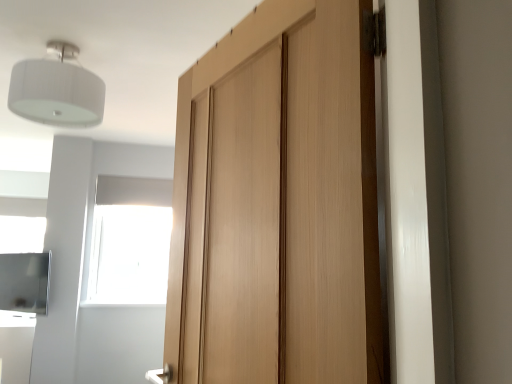
Find the location of a particular element. The height and width of the screenshot is (384, 512). white fabric lampshade at upper left is located at coordinates (57, 90).

How far apart are satin silver cabinet at lower left and transparent glass window at upper center?

satin silver cabinet at lower left and transparent glass window at upper center are 25.54 inches apart.

Is the position of satin silver cabinet at lower left more distant than that of transparent glass window at upper center?

No.

From the picture: Is satin silver cabinet at lower left at the right side of transparent glass window at upper center?

No, satin silver cabinet at lower left is not to the right of transparent glass window at upper center.

Does point (40, 296) appear closer or farther from the camera than point (117, 294)?

Point (40, 296) is positioned closer to the camera compared to point (117, 294).

The height and width of the screenshot is (384, 512). Find the location of `door that is under the white fabric lampshade at upper left (from a real-world perspective)`. door that is under the white fabric lampshade at upper left (from a real-world perspective) is located at coordinates (278, 203).

Consider the image. Is light wood door at center looking in the opposite direction of white fabric lampshade at upper left?

light wood door at center does not have its back to white fabric lampshade at upper left.

Is light wood door at center inside or outside of white fabric lampshade at upper left?

light wood door at center lies outside white fabric lampshade at upper left.

Is light wood door at center next to white fabric lampshade at upper left and touching it?

light wood door at center is not next to white fabric lampshade at upper left, and they're not touching.

Where is `cabinetry on the left of transparent glass window at upper center`? The image size is (512, 384). cabinetry on the left of transparent glass window at upper center is located at coordinates (25, 282).

From a real-world perspective, is transparent glass window at upper center located beneath satin silver cabinet at lower left?

Actually, transparent glass window at upper center is physically above satin silver cabinet at lower left in the real world.

Based on their sizes in the image, would you say transparent glass window at upper center is bigger or smaller than satin silver cabinet at lower left?

In the image, transparent glass window at upper center appears to be larger than satin silver cabinet at lower left.

From the image's perspective, who appears lower, transparent glass window at upper center or satin silver cabinet at lower left?

From the image's view, satin silver cabinet at lower left is below.

Is white fabric lampshade at upper left positioned before transparent glass window at upper center?

Yes, the depth of white fabric lampshade at upper left is less than that of transparent glass window at upper center.

Can you confirm if white fabric lampshade at upper left is bigger than transparent glass window at upper center?

No.

Between white fabric lampshade at upper left and transparent glass window at upper center, which one has smaller width?

transparent glass window at upper center.

Is white fabric lampshade at upper left located outside transparent glass window at upper center?

Absolutely, white fabric lampshade at upper left is external to transparent glass window at upper center.

Considering the relative sizes of white fabric lampshade at upper left and satin silver cabinet at lower left in the image provided, is white fabric lampshade at upper left thinner than satin silver cabinet at lower left?

Incorrect, the width of white fabric lampshade at upper left is not less than that of satin silver cabinet at lower left.

Based on the photo, which of these two, white fabric lampshade at upper left or satin silver cabinet at lower left, is smaller?

With smaller size is satin silver cabinet at lower left.

Is white fabric lampshade at upper left inside the boundaries of satin silver cabinet at lower left, or outside?

white fabric lampshade at upper left cannot be found inside satin silver cabinet at lower left.

Who is shorter, white fabric lampshade at upper left or satin silver cabinet at lower left?

Standing shorter between the two is white fabric lampshade at upper left.

Where is `light fixture located above the transparent glass window at upper center (from the image's perspective)`? This screenshot has width=512, height=384. light fixture located above the transparent glass window at upper center (from the image's perspective) is located at coordinates (57, 90).

Is point (151, 263) less distant than point (18, 67)?

No.

Which object is wider, transparent glass window at upper center or white fabric lampshade at upper left?

white fabric lampshade at upper left.

From a real-world perspective, is transparent glass window at upper center on white fabric lampshade at upper left?

Actually, transparent glass window at upper center is physically below white fabric lampshade at upper left in the real world.

Consider the image. In the image, is white fabric lampshade at upper left on the left side or the right side of light wood door at center?

In the image, white fabric lampshade at upper left appears on the left side of light wood door at center.

Considering the positions of points (96, 97) and (187, 360), is point (96, 97) farther from camera compared to point (187, 360)?

That is True.

Consider the image. Is white fabric lampshade at upper left facing away from light wood door at center?

That's not correct — white fabric lampshade at upper left is not looking away from light wood door at center.

Identify the location of window above the satin silver cabinet at lower left (from a real-world perspective). (129, 241).

What are the coordinates of `door on the right of white fabric lampshade at upper left` in the screenshot? It's located at (278, 203).

Based on their spatial positions, is satin silver cabinet at lower left or light wood door at center further from white fabric lampshade at upper left?

satin silver cabinet at lower left lies further to white fabric lampshade at upper left than the other object.

Looking at the image, which one is located further to light wood door at center, white fabric lampshade at upper left or satin silver cabinet at lower left?

Based on the image, satin silver cabinet at lower left appears to be further to light wood door at center.

Looking at the image, which one is located closer to satin silver cabinet at lower left, light wood door at center or transparent glass window at upper center?

Among the two, transparent glass window at upper center is located nearer to satin silver cabinet at lower left.

Considering their positions, is light wood door at center positioned further to white fabric lampshade at upper left than satin silver cabinet at lower left?

satin silver cabinet at lower left is further to white fabric lampshade at upper left.

From the image, which object appears to be nearer to satin silver cabinet at lower left, transparent glass window at upper center or light wood door at center?

transparent glass window at upper center.

From the image, which object appears to be nearer to transparent glass window at upper center, satin silver cabinet at lower left or light wood door at center?

The object closer to transparent glass window at upper center is satin silver cabinet at lower left.

Looking at the image, which one is located closer to satin silver cabinet at lower left, transparent glass window at upper center or white fabric lampshade at upper left?

The object closer to satin silver cabinet at lower left is transparent glass window at upper center.

Considering their positions, is light wood door at center positioned closer to transparent glass window at upper center than satin silver cabinet at lower left?

satin silver cabinet at lower left lies closer to transparent glass window at upper center than the other object.

The image size is (512, 384). I want to click on cabinetry between white fabric lampshade at upper left and transparent glass window at upper center in the front-back direction, so click(25, 282).

The height and width of the screenshot is (384, 512). I want to click on cabinetry between light wood door at center and transparent glass window at upper center in the front-back direction, so click(x=25, y=282).

This screenshot has width=512, height=384. I want to click on light fixture between light wood door at center and satin silver cabinet at lower left along the z-axis, so click(57, 90).

At what (x,y) coordinates should I click in order to perform the action: click on light fixture between light wood door at center and transparent glass window at upper center from front to back. Please return your answer as a coordinate pair (x, y). Looking at the image, I should click on (57, 90).